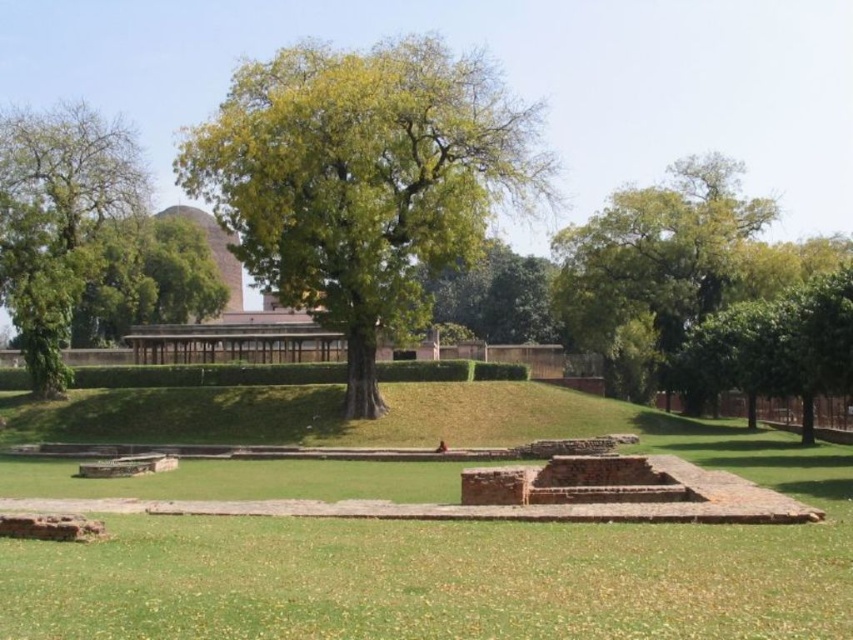
Is green leafy tree at center bigger than green leafy tree at left?

Correct, green leafy tree at center is larger in size than green leafy tree at left.

Which is more to the right, green leafy tree at center or green leafy tree at left?

Positioned to the right is green leafy tree at center.

This screenshot has width=853, height=640. Identify the location of green leafy tree at center. (363, 182).

Can you confirm if green grass at center is positioned below green leafy tree at center?

Correct, green grass at center is located below green leafy tree at center.

In the scene shown: Can you confirm if green grass at center is positioned to the left of green leafy tree at center?

Incorrect, green grass at center is not on the left side of green leafy tree at center.

The width and height of the screenshot is (853, 640). I want to click on green grass at center, so click(x=467, y=552).

This screenshot has height=640, width=853. In order to click on green grass at center in this screenshot , I will do `click(467, 552)`.

Is green leafy tree at upper right below green leafy tree at left?

Yes.

How far apart are green leafy tree at upper right and green leafy tree at left?

They are 129.30 feet apart.

Who is more distant from viewer, (x=694, y=307) or (x=13, y=228)?

Point (x=694, y=307)

At what (x,y) coordinates should I click in order to perform the action: click on green leafy tree at upper right. Please return your answer as a coordinate pair (x, y). This screenshot has width=853, height=640. Looking at the image, I should click on (x=654, y=266).